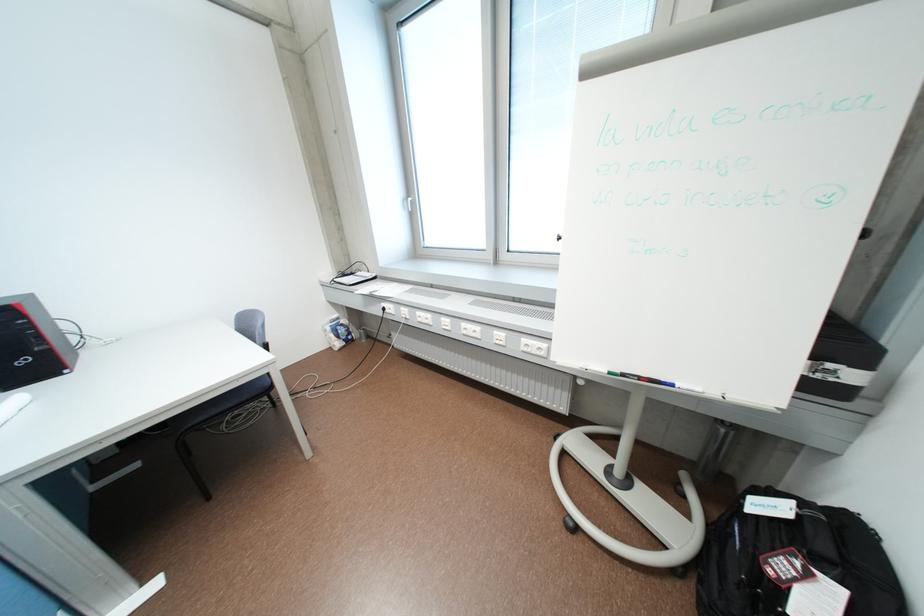
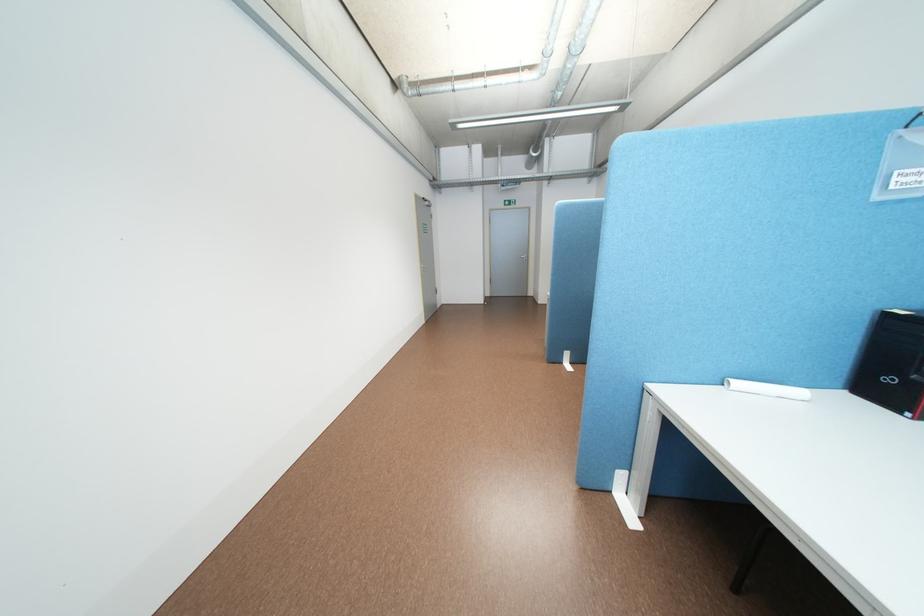
Question: I am providing you with two images of the same scene from different viewpoints. Which of the following objects are not visible in image2?

Choices:
 (A) silver door handle
 (B) rolled white paper
 (C) clear plastic pouch
 (D) none of these

Answer: (D)